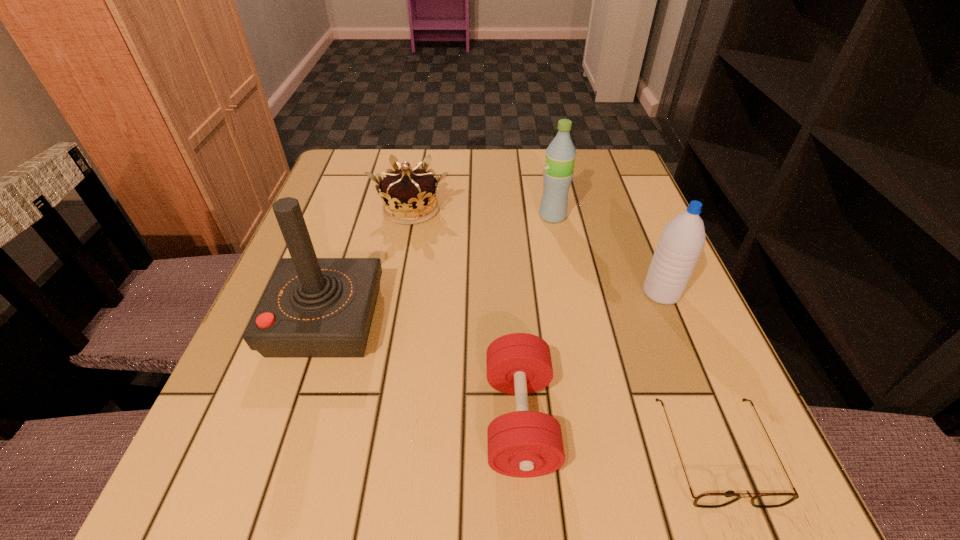
Locate an element on the screen. The image size is (960, 540). free space that is in between the right water bottle and the joystick is located at coordinates click(x=493, y=307).

Locate an element on the screen. This screenshot has width=960, height=540. free spot between the nearer water bottle and the third object from left to right is located at coordinates (590, 356).

Find the location of a particular element. The width and height of the screenshot is (960, 540). unoccupied area between the nearer water bottle and the dumbbell is located at coordinates (590, 356).

You are a GUI agent. You are given a task and a screenshot of the screen. Output one action in this format:
    pyautogui.click(x=<x>, y=<y>)
    Task: Click on the free space between the second shortest object and the farther water bottle
    The height and width of the screenshot is (540, 960).
    Given the screenshot: What is the action you would take?
    pyautogui.click(x=536, y=318)

Where is `vacant space that is in between the joystick and the right water bottle`? This screenshot has height=540, width=960. vacant space that is in between the joystick and the right water bottle is located at coordinates pyautogui.click(x=493, y=307).

Where is `blank region between the left water bottle and the joystick`? blank region between the left water bottle and the joystick is located at coordinates (440, 268).

This screenshot has width=960, height=540. I want to click on free space between the dumbbell and the crown, so click(466, 314).

You are a GUI agent. You are given a task and a screenshot of the screen. Output one action in this format:
    pyautogui.click(x=<x>, y=<y>)
    Task: Click on the object that is the third closest to the third shortest object
    The width and height of the screenshot is (960, 540).
    Given the screenshot: What is the action you would take?
    (523, 444)

Identify the location of object that is the second nearest to the crown. The height and width of the screenshot is (540, 960). (560, 156).

Locate an element on the screen. free space that satisfies the following two spatial constraints: 1. on the front side of the third shortest object; 2. on the rectangular base of the joystick is located at coordinates (390, 320).